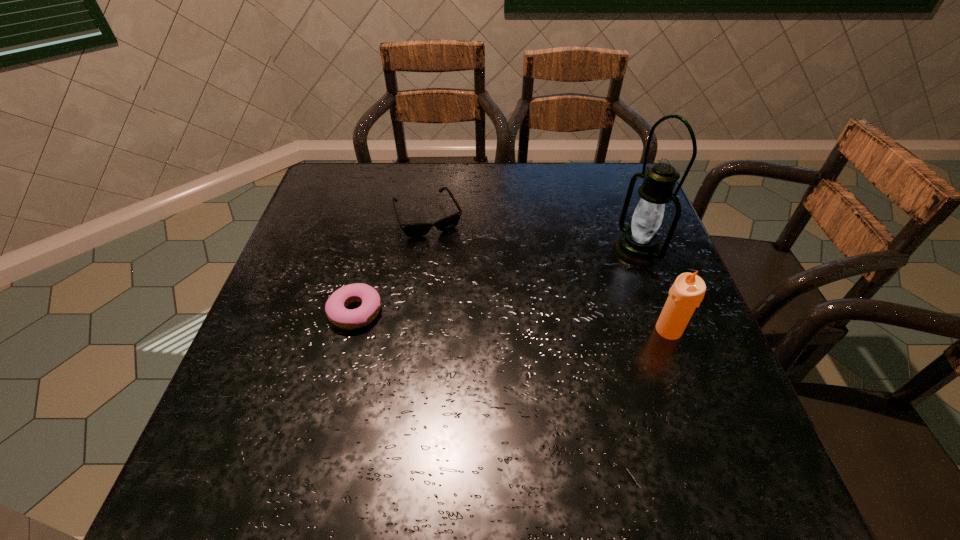
You are a GUI agent. You are given a task and a screenshot of the screen. Output one action in this format:
    pyautogui.click(x=<x>, y=<y>)
    Task: Click on the vacant area situated 0.300m on the front-facing side of the sunglasses
    
    Given the screenshot: What is the action you would take?
    pyautogui.click(x=478, y=326)

Where is `free space located on the front-facing side of the sunglasses`? The height and width of the screenshot is (540, 960). free space located on the front-facing side of the sunglasses is located at coordinates (468, 303).

Locate an element on the screen. object positioned at the far edge is located at coordinates (412, 230).

What are the coordinates of `object situated at the left edge` in the screenshot? It's located at (335, 308).

What are the coordinates of `candle at the right edge` in the screenshot? It's located at [x=687, y=292].

Find the location of a particular element. lantern located in the right edge section of the desktop is located at coordinates (638, 245).

The height and width of the screenshot is (540, 960). Find the location of `blank area at the far edge`. blank area at the far edge is located at coordinates (449, 177).

Locate an element on the screen. This screenshot has height=540, width=960. vacant space at the near edge of the desktop is located at coordinates (460, 399).

What are the coordinates of `free space at the left edge of the desktop` in the screenshot? It's located at (261, 331).

Locate an element on the screen. This screenshot has width=960, height=540. vacant region at the right edge of the desktop is located at coordinates (656, 344).